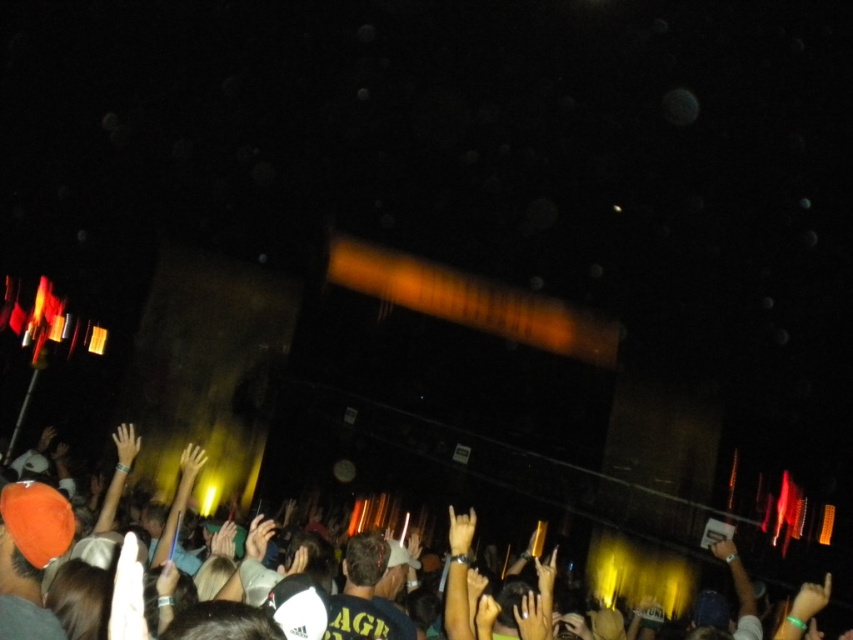
Question: Is orange fabric hat at lower left thinner than light brown leather hand at center?

Choices:
 (A) yes
 (B) no

Answer: (B)

Question: Can you confirm if orange fabric hat at lower left is bigger than light brown leather hand at center?

Choices:
 (A) no
 (B) yes

Answer: (B)

Question: Is orange fabric hat at lower left behind light brown leather hand at center?

Choices:
 (A) yes
 (B) no

Answer: (A)

Question: Which object appears farthest from the camera in this image?

Choices:
 (A) orange fabric hat at lower left
 (B) light brown leather hand at center

Answer: (A)

Question: Which point is closer to the camera taking this photo?

Choices:
 (A) (384, 520)
 (B) (457, 536)

Answer: (B)